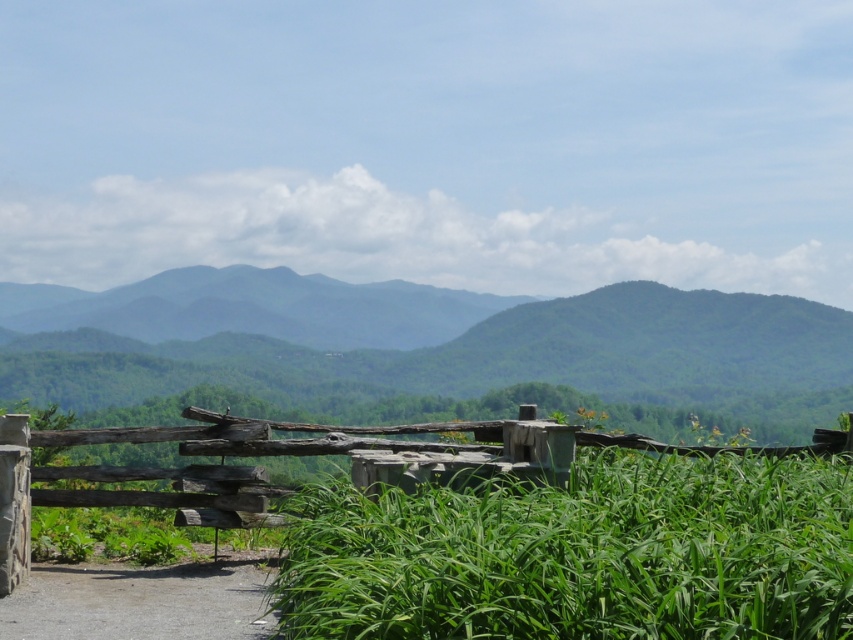
Identify the location of green textured mountain at center. The height and width of the screenshot is (640, 853). (476, 353).

Is green textured mountain at center bigger than dirt/gravel path at lower left?

Yes, green textured mountain at center is bigger than dirt/gravel path at lower left.

The height and width of the screenshot is (640, 853). What are the coordinates of `green textured mountain at center` in the screenshot? It's located at (476, 353).

Consider the image. Is green grassy field at center thinner than dirt/gravel path at lower left?

No.

Is point (465, 602) more distant than point (122, 568)?

No, (465, 602) is in front of (122, 568).

In order to click on green grassy field at center in this screenshot , I will do `click(579, 552)`.

Between green grassy field at center and green textured mountain at center, which one appears on the left side from the viewer's perspective?

Positioned to the left is green textured mountain at center.

Can you confirm if green grassy field at center is bigger than green textured mountain at center?

Actually, green grassy field at center might be smaller than green textured mountain at center.

The height and width of the screenshot is (640, 853). What are the coordinates of `green grassy field at center` in the screenshot? It's located at (579, 552).

At what (x,y) coordinates should I click in order to perform the action: click on green grassy field at center. Please return your answer as a coordinate pair (x, y). This screenshot has width=853, height=640. Looking at the image, I should click on (579, 552).